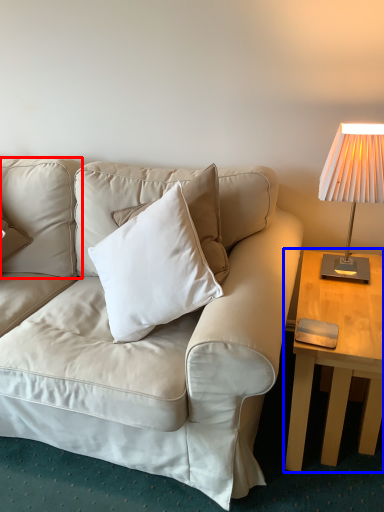
Question: Which point is closer to the camera, pillow (highlighted by a red box) or table (highlighted by a blue box)?

Choices:
 (A) pillow
 (B) table

Answer: (B)